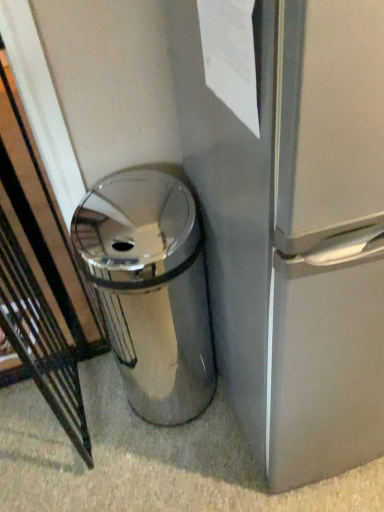
Question: Is white paper at upper center wider or thinner than polished silver trash can at center?

Choices:
 (A) wide
 (B) thin

Answer: (B)

Question: In terms of height, does white paper at upper center look taller or shorter compared to polished silver trash can at center?

Choices:
 (A) tall
 (B) short

Answer: (B)

Question: From the image's perspective, relative to polished silver trash can at center, is white paper at upper center above or below?

Choices:
 (A) below
 (B) above

Answer: (B)

Question: Considering the positions of polished silver trash can at center and white paper at upper center in the image, is polished silver trash can at center taller or shorter than white paper at upper center?

Choices:
 (A) short
 (B) tall

Answer: (B)

Question: Based on their sizes in the image, would you say polished silver trash can at center is bigger or smaller than white paper at upper center?

Choices:
 (A) small
 (B) big

Answer: (B)

Question: Is polished silver trash can at center spatially inside white paper at upper center, or outside of it?

Choices:
 (A) inside
 (B) outside

Answer: (B)

Question: Is polished silver trash can at center in front of or behind white paper at upper center in the image?

Choices:
 (A) front
 (B) behind

Answer: (B)